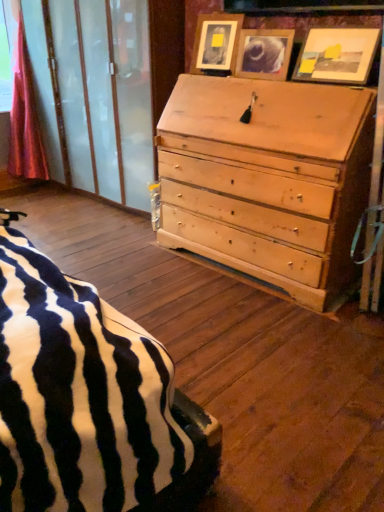
This screenshot has width=384, height=512. Identify the location of free point above wooden picture frame at upper center, placed as the first picture frame when sorted from left to right (from a real-world perspective). (225, 8).